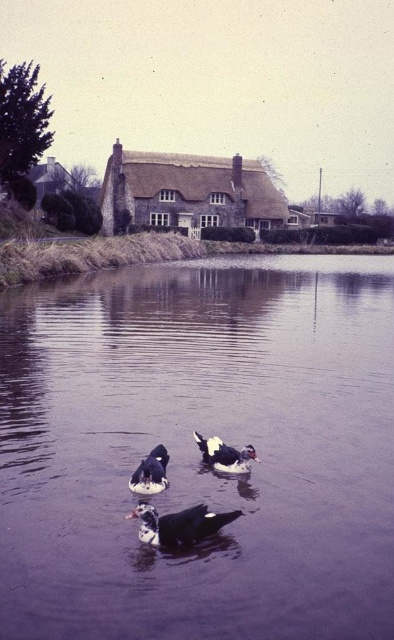
Who is positioned more to the right, black glossy duck at center or black glossy duck at lower left?

Answer: black glossy duck at center

Which is above, black glossy duck at center or black glossy duck at lower left?

black glossy duck at lower left

Is point (165, 545) closer to camera compared to point (159, 445)?

Yes, it is in front of point (159, 445).

Find the location of a particular element. The height and width of the screenshot is (640, 394). black glossy duck at center is located at coordinates (178, 524).

Is point (159, 340) positioned after point (217, 531)?

That is True.

Measure the distance between purple smooth water at center and black glossy duck at center.

6.14 meters

Locate an element on the screen. The width and height of the screenshot is (394, 640). purple smooth water at center is located at coordinates (198, 451).

Who is more forward, [230,465] or [156,467]?

Point [156,467]

Is point (237, 472) positioned after point (154, 461)?

Yes, it is behind point (154, 461).

Find the location of a particular element. Image resolution: width=394 pixels, height=640 pixels. white glossy duck at center is located at coordinates (224, 454).